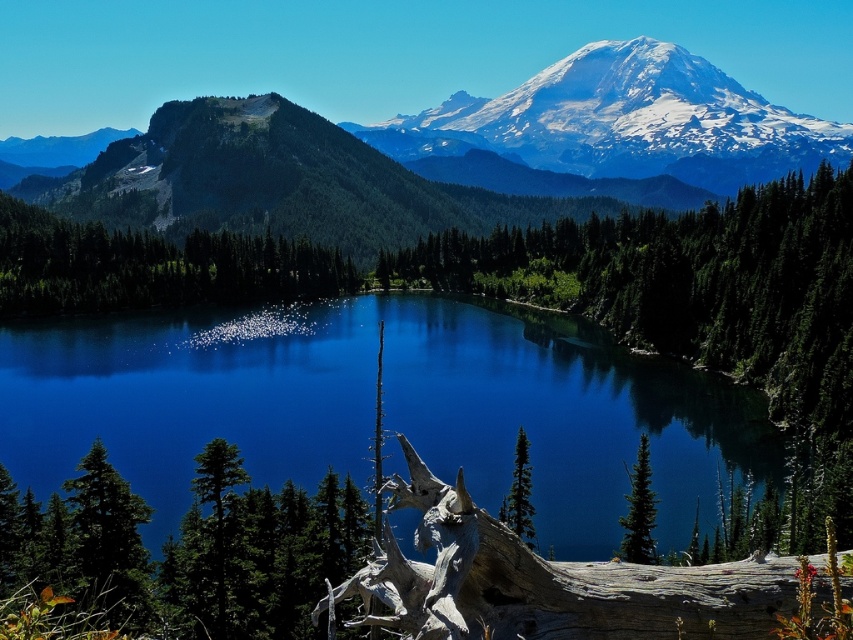
Is green forested mountain at upper left smaller than green matte tree at center?

Actually, green forested mountain at upper left might be larger than green matte tree at center.

Is green forested mountain at upper left bigger than green matte tree at center?

Indeed, green forested mountain at upper left has a larger size compared to green matte tree at center.

Between point (251, 154) and point (506, 508), which one is positioned behind?

The point (251, 154) is more distant.

Identify the location of green forested mountain at upper left. The width and height of the screenshot is (853, 640). (450, 154).

Is green forested mountain at upper left smaller than gray textured log at lower center?

No.

Is green forested mountain at upper left further to camera compared to gray textured log at lower center?

Yes, green forested mountain at upper left is further from the viewer.

Find the location of a particular element. The image size is (853, 640). green forested mountain at upper left is located at coordinates (450, 154).

Does deep blue water at center have a lesser height compared to gray textured log at lower center?

No.

Who is more distant from viewer, [519,348] or [659,573]?

Positioned behind is point [519,348].

Where is `deep blue water at center`? Image resolution: width=853 pixels, height=640 pixels. deep blue water at center is located at coordinates (383, 406).